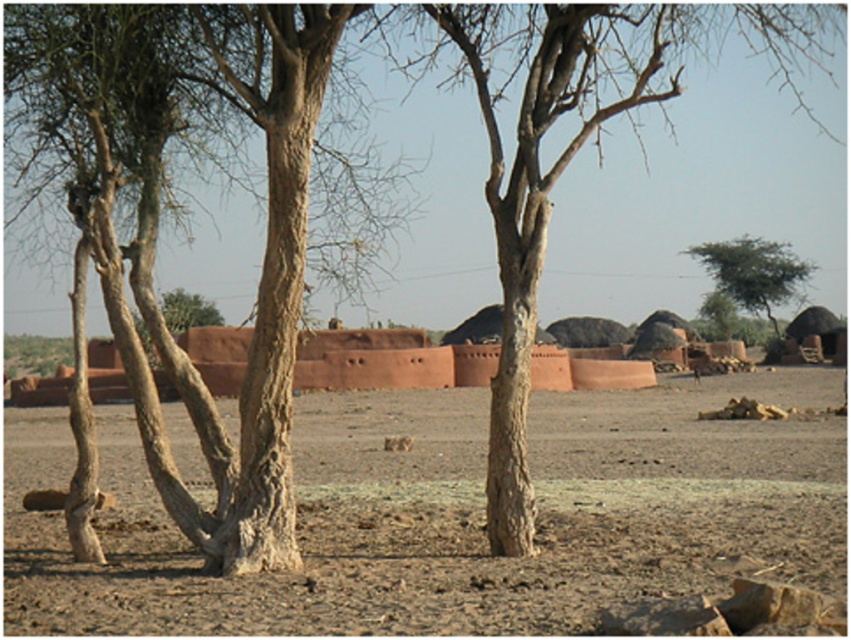
You are standing in the middle of the rural landscape and want to place a small statue on the ground. The statue requires a base that is taller than the surrounding ground. Which object between the brown sandy dirt at center and the brown rough tree trunk at center would be suitable as a base for the statue?

The brown rough tree trunk at center is taller than the brown sandy dirt at center, so it would be suitable as a base for the statue since it provides a higher elevation than the surrounding ground.

You are an environmental scientist assessing the vegetation in this rural area. You notice the green leafy tree at upper right and the brown rough tree trunk at center. Which tree is positioned higher in the image?

The green leafy tree at upper right is located above the brown rough tree trunk at center in the image.

You are standing at the origin point in the rural landscape image. A green leafy tree at upper right is marked by point (752, 272). Which direction should you face to see the green leafy tree at upper right?

You should face the upper right direction to see the green leafy tree at upper right marked by point (752, 272).